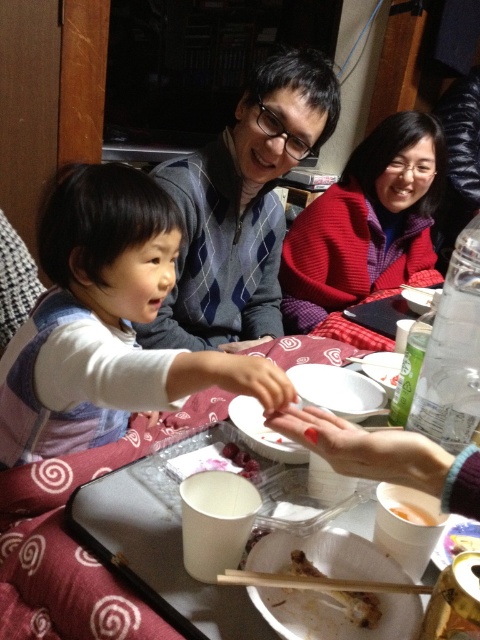
Can you confirm if white paper tray at lower center is positioned above brown wooden chopsticks at lower center?

Indeed, white paper tray at lower center is positioned over brown wooden chopsticks at lower center.

Does point (83, 499) come behind point (359, 605)?

Yes, it is.

Between point (129, 536) and point (371, 604), which one is positioned behind?

Point (129, 536)

Where is `white paper tray at lower center`? This screenshot has height=640, width=480. white paper tray at lower center is located at coordinates (159, 544).

Between matte gray sweater at center and brown wooden chopsticks at lower center, which one is positioned higher?

Positioned higher is matte gray sweater at center.

I want to click on matte gray sweater at center, so click(x=241, y=209).

Who is positioned more to the right, matte gray sweater at center or shiny red cherries at center?

matte gray sweater at center is more to the right.

Which is in front, point (312, 129) or point (173, 461)?

Positioned in front is point (173, 461).

The width and height of the screenshot is (480, 640). In order to click on matte gray sweater at center in this screenshot , I will do pos(241,209).

The width and height of the screenshot is (480, 640). Identify the location of matte gray sweater at center. (241, 209).